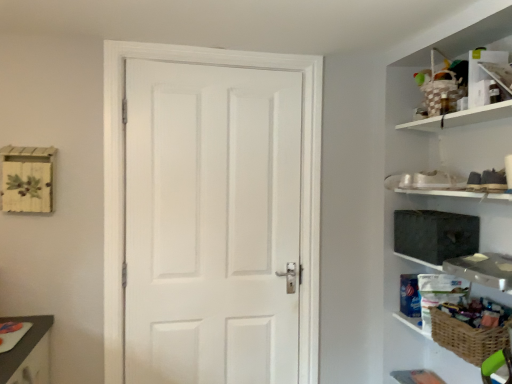
Question: From the image's perspective, does woven wicker basket at right appear higher than white matte door at center?

Choices:
 (A) yes
 (B) no

Answer: (B)

Question: From the image's perspective, would you say woven wicker basket at right is shown under white matte door at center?

Choices:
 (A) yes
 (B) no

Answer: (A)

Question: Is woven wicker basket at right not inside white matte door at center?

Choices:
 (A) yes
 (B) no

Answer: (A)

Question: Can you confirm if woven wicker basket at right is smaller than white matte door at center?

Choices:
 (A) yes
 (B) no

Answer: (A)

Question: Can you confirm if woven wicker basket at right is bigger than white matte door at center?

Choices:
 (A) no
 (B) yes

Answer: (A)

Question: Can you confirm if woven wicker basket at right is shorter than white matte door at center?

Choices:
 (A) yes
 (B) no

Answer: (A)

Question: From the image's perspective, is dark gray fabric medicine cabinet at right below white matte door at center?

Choices:
 (A) yes
 (B) no

Answer: (B)

Question: Is dark gray fabric medicine cabinet at right looking in the opposite direction of white matte door at center?

Choices:
 (A) no
 (B) yes

Answer: (A)

Question: Considering the relative sizes of dark gray fabric medicine cabinet at right and white matte door at center in the image provided, is dark gray fabric medicine cabinet at right bigger than white matte door at center?

Choices:
 (A) yes
 (B) no

Answer: (B)

Question: Is dark gray fabric medicine cabinet at right further to the viewer compared to white matte door at center?

Choices:
 (A) yes
 (B) no

Answer: (B)

Question: Considering the relative sizes of dark gray fabric medicine cabinet at right and white matte door at center in the image provided, is dark gray fabric medicine cabinet at right smaller than white matte door at center?

Choices:
 (A) no
 (B) yes

Answer: (B)

Question: Does dark gray fabric medicine cabinet at right contain white matte door at center?

Choices:
 (A) no
 (B) yes

Answer: (A)

Question: Is dark gray fabric medicine cabinet at right taller than woven brown basket at lower right?

Choices:
 (A) no
 (B) yes

Answer: (B)